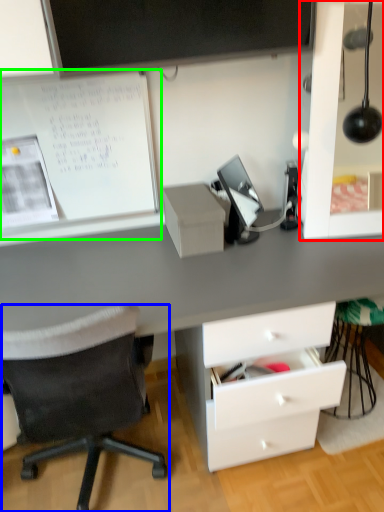
Question: Estimate the real-world distances between objects in this image. Which object is closer to dresser (highlighted by a red box), chair (highlighted by a blue box) or bulletin board (highlighted by a green box)?

Choices:
 (A) chair
 (B) bulletin board

Answer: (B)